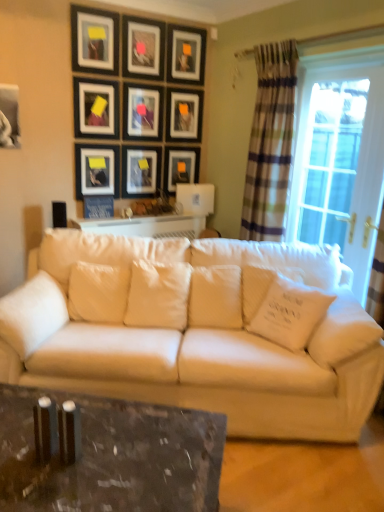
Question: Considering the relative sizes of matte black picture frame at upper left, which is counted as the 9th picture frame, starting from the top, and matte black picture frame at center, which is the seventh picture frame from top to bottom, in the image provided, is matte black picture frame at upper left, which is counted as the 9th picture frame, starting from the top, thinner than matte black picture frame at center, which is the seventh picture frame from top to bottom,?

Choices:
 (A) no
 (B) yes

Answer: (A)

Question: Is matte black picture frame at upper left, the 2th picture frame in the bottom-to-top sequence, at the left side of matte black picture frame at center, which is the seventh picture frame from top to bottom?

Choices:
 (A) yes
 (B) no

Answer: (A)

Question: Can you confirm if matte black picture frame at upper left, the 2th picture frame in the bottom-to-top sequence, is positioned to the right of matte black picture frame at center, which is the seventh picture frame from top to bottom?

Choices:
 (A) yes
 (B) no

Answer: (B)

Question: Does matte black picture frame at upper left, the 2th picture frame in the bottom-to-top sequence, have a larger size compared to matte black picture frame at center, the fourth picture frame ordered from the bottom?

Choices:
 (A) yes
 (B) no

Answer: (A)

Question: Can you confirm if matte black picture frame at upper left, which is counted as the 9th picture frame, starting from the top, is taller than matte black picture frame at center, the fourth picture frame ordered from the bottom?

Choices:
 (A) yes
 (B) no

Answer: (A)

Question: From the image's perspective, relative to matte black picture frame at upper center, the 4th picture frame from the top, is white soft pillow at right, the first pillow positioned from the right, above or below?

Choices:
 (A) above
 (B) below

Answer: (B)

Question: Considering the positions of white soft pillow at right, which is counted as the fifth pillow, starting from the left, and matte black picture frame at upper center, the 4th picture frame from the top, in the image, is white soft pillow at right, which is counted as the fifth pillow, starting from the left, wider or thinner than matte black picture frame at upper center, the 4th picture frame from the top,?

Choices:
 (A) wide
 (B) thin

Answer: (A)

Question: From their relative heights in the image, would you say white soft pillow at right, the first pillow positioned from the right, is taller or shorter than matte black picture frame at upper center, the 4th picture frame from the top?

Choices:
 (A) short
 (B) tall

Answer: (A)

Question: Considering their positions, is white soft pillow at right, which is counted as the fifth pillow, starting from the left, located in front of or behind matte black picture frame at upper center, the 7th picture frame from the bottom?

Choices:
 (A) behind
 (B) front

Answer: (B)

Question: Based on their sizes in the image, would you say matte black picture frame at upper center, the second picture frame positioned from the top, is bigger or smaller than matte black picture frame at upper center, the sixth picture frame in the top-to-bottom sequence?

Choices:
 (A) small
 (B) big

Answer: (B)

Question: Looking at their shapes, would you say matte black picture frame at upper center, which is the 9th picture frame in bottom-to-top order, is wider or thinner than matte black picture frame at upper center, the sixth picture frame in the top-to-bottom sequence?

Choices:
 (A) thin
 (B) wide

Answer: (B)

Question: Is point (158, 24) closer or farther from the camera than point (99, 117)?

Choices:
 (A) farther
 (B) closer

Answer: (A)

Question: In terms of height, does matte black picture frame at upper center, which is the 9th picture frame in bottom-to-top order, look taller or shorter compared to matte black picture frame at upper center, the sixth picture frame in the top-to-bottom sequence?

Choices:
 (A) short
 (B) tall

Answer: (A)

Question: From their relative heights in the image, would you say clear glass window at right is taller or shorter than matte black picture frame at upper center, the second picture frame positioned from the top?

Choices:
 (A) tall
 (B) short

Answer: (A)

Question: Considering the relative positions of clear glass window at right and matte black picture frame at upper center, the second picture frame positioned from the top, in the image provided, is clear glass window at right to the left or to the right of matte black picture frame at upper center, the second picture frame positioned from the top,?

Choices:
 (A) right
 (B) left

Answer: (A)